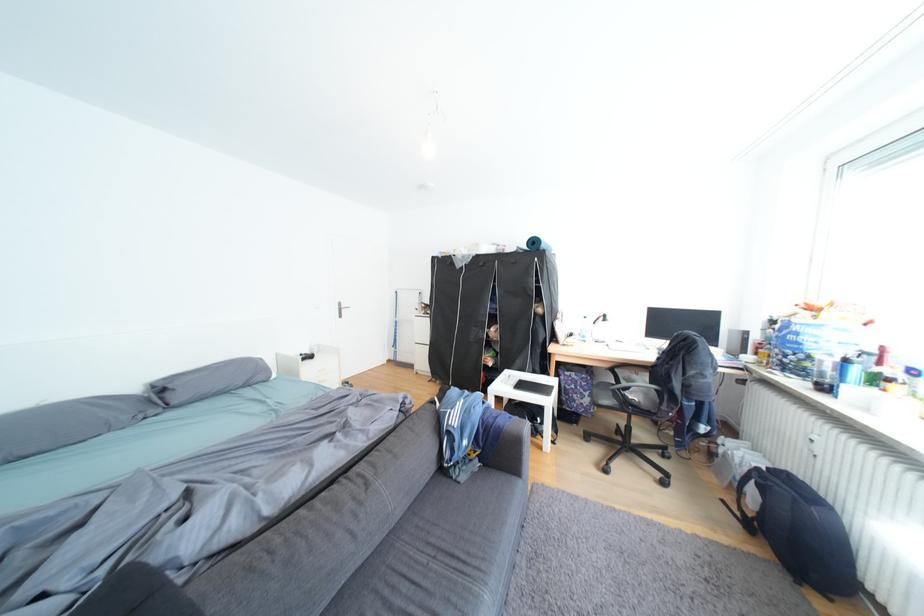
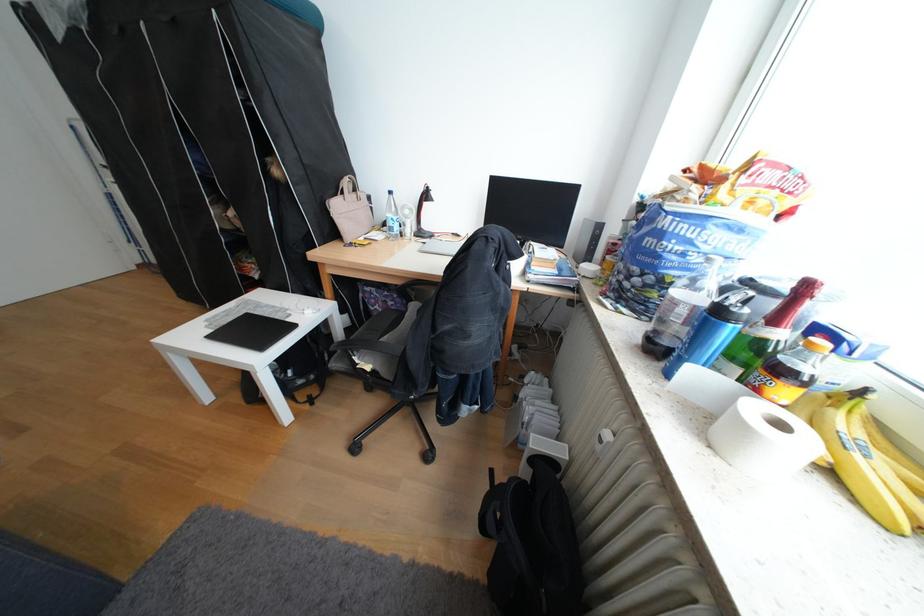
In the second image, find the point that corresponds to pixel 749 454 in the first image.

(541, 410)